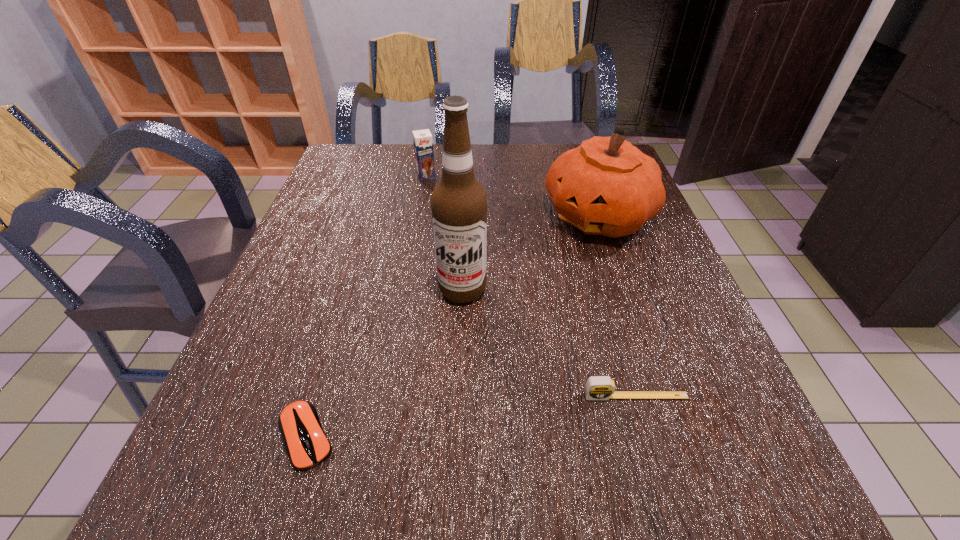
Locate an element on the screen. The image size is (960, 540). the shortest object is located at coordinates (308, 446).

Locate an element on the screen. Image resolution: width=960 pixels, height=540 pixels. the nearest object is located at coordinates (308, 446).

Identify the location of the fourth farthest object. Image resolution: width=960 pixels, height=540 pixels. (597, 387).

The height and width of the screenshot is (540, 960). Find the location of `tape measure`. tape measure is located at coordinates (597, 387).

The width and height of the screenshot is (960, 540). What are the coordinates of `the farthest object` in the screenshot? It's located at (423, 143).

Where is `the third tallest object`? Image resolution: width=960 pixels, height=540 pixels. the third tallest object is located at coordinates (423, 143).

I want to click on the third nearest object, so click(x=458, y=202).

The width and height of the screenshot is (960, 540). In order to click on the third object from right to left in this screenshot , I will do `click(458, 202)`.

You are a GUI agent. You are given a task and a screenshot of the screen. Output one action in this format:
    pyautogui.click(x=<x>, y=<y>)
    Task: Click on the fourth shortest object
    The width and height of the screenshot is (960, 540).
    Given the screenshot: What is the action you would take?
    pyautogui.click(x=606, y=186)

The height and width of the screenshot is (540, 960). I want to click on the second farthest object, so click(606, 186).